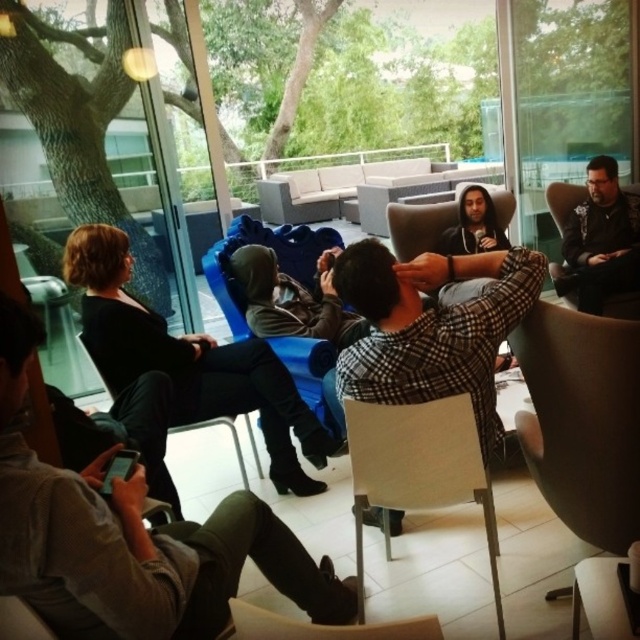
From the picture: Which of these two, dark gray fabric jacket at center or matte black chair at center, stands taller?

Standing taller between the two is dark gray fabric jacket at center.

Does dark gray fabric jacket at center have a smaller size compared to matte black chair at center?

No, dark gray fabric jacket at center is not smaller than matte black chair at center.

What are the coordinates of `dark gray fabric jacket at center` in the screenshot? It's located at (131, 538).

Measure the distance between point (435, 486) and camera.

5.66 feet

Who is lower down, light beige fabric chair at center or matte black chair at center?

light beige fabric chair at center

Between point (442, 449) and point (218, 419), which one is positioned behind?

The point (218, 419) is behind.

Locate an element on the screen. light beige fabric chair at center is located at coordinates (417, 468).

Based on the photo, which of these two, black checkered shirt at center or light beige fabric chair at center, stands taller?

light beige fabric chair at center is taller.

At what (x,y) coordinates should I click in order to perform the action: click on black checkered shirt at center. Please return your answer as a coordinate pair (x, y). This screenshot has height=640, width=640. Looking at the image, I should click on (432, 326).

Based on the photo, who is more distant from viewer, (x=360, y=365) or (x=360, y=438)?

The point (x=360, y=365) is more distant.

Find the location of a particular element. This screenshot has height=640, width=640. black checkered shirt at center is located at coordinates coord(432,326).